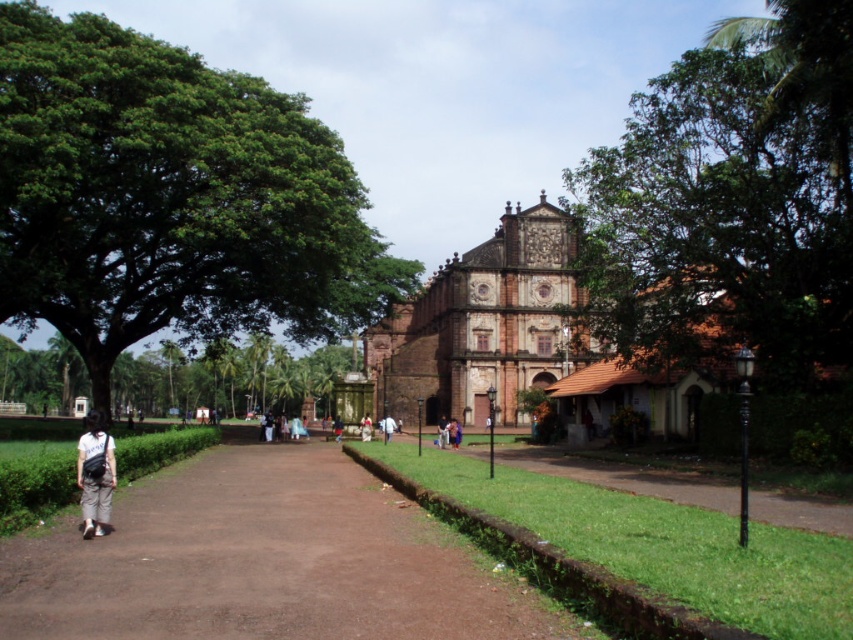
Question: Which of the following is the farthest from the observer?

Choices:
 (A) (389, 422)
 (B) (519, 212)
 (C) (263, 314)

Answer: (C)

Question: Can you confirm if brown dirt path at center is positioned below green leafy tree at lower left?

Choices:
 (A) yes
 (B) no

Answer: (A)

Question: Among these points, which one is nearest to the camera?

Choices:
 (A) (370, 419)
 (B) (45, 145)

Answer: (B)

Question: Does brown textured stone church at center appear under light beige fabric bag at lower left?

Choices:
 (A) no
 (B) yes

Answer: (A)

Question: Where is green leafy tree at center located in relation to light brown fabric dress at center in the image?

Choices:
 (A) below
 (B) above

Answer: (B)

Question: Estimate the real-world distances between objects in this image. Which object is closer to the light brown fabric dress at center?

Choices:
 (A) light brown fabric pants at center
 (B) green leafy tree at center
 (C) brown textured stone church at center
 (D) white fabric at center

Answer: (D)